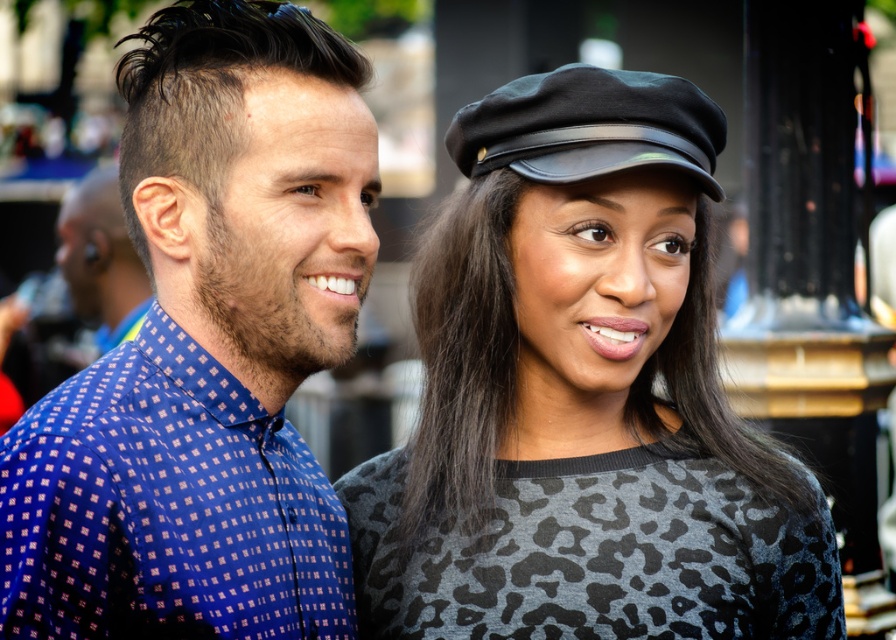
Question: Is the position of leopard print sweater at center more distant than that of black leather beret at upper center?

Choices:
 (A) no
 (B) yes

Answer: (A)

Question: Which object appears farthest from the camera in this image?

Choices:
 (A) blue printed shirt at left
 (B) black leather beret at upper center
 (C) leopard print sweater at center

Answer: (B)

Question: Does leopard print sweater at center have a smaller size compared to blue printed shirt at left?

Choices:
 (A) no
 (B) yes

Answer: (A)

Question: Observing the image, what is the correct spatial positioning of leopard print sweater at center in reference to black leather beret at upper center?

Choices:
 (A) left
 (B) right

Answer: (B)

Question: Which object is the farthest from the blue printed shirt at left?

Choices:
 (A) black leather beret at upper center
 (B) leopard print sweater at center

Answer: (B)

Question: Estimate the real-world distances between objects in this image. Which object is closer to the blue printed shirt at left?

Choices:
 (A) leopard print sweater at center
 (B) black leather beret at upper center

Answer: (B)